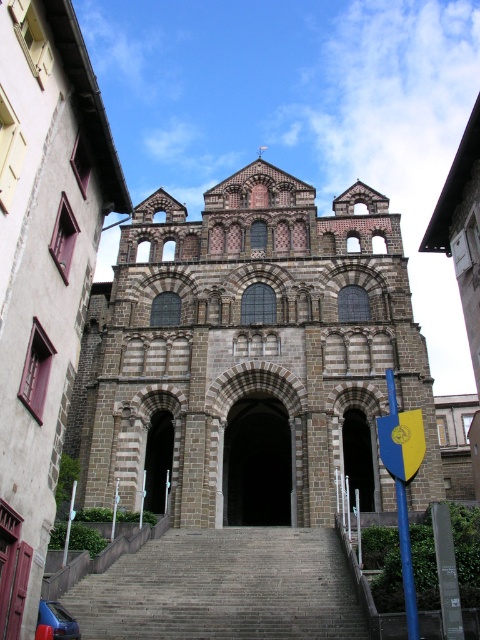
Is point (233, 412) positioned before point (159, 477)?

Yes, it is.

Does point (237, 520) come farther from viewer compared to point (147, 456)?

Yes, point (237, 520) is behind point (147, 456).

Locate an element on the screen. dark stone archway at center is located at coordinates (256, 464).

Which is more to the right, gray stone stairs at center or brown stone archway at center?

Positioned to the right is gray stone stairs at center.

What do you see at coordinates (223, 588) in the screenshot? I see `gray stone stairs at center` at bounding box center [223, 588].

The width and height of the screenshot is (480, 640). I want to click on gray stone stairs at center, so click(x=223, y=588).

Does gray stone stairs at center have a smaller size compared to brown stone arch at center?

Indeed, gray stone stairs at center has a smaller size compared to brown stone arch at center.

Does point (262, 554) come behind point (365, 490)?

No.

This screenshot has height=640, width=480. Find the location of `gray stone stairs at center`. gray stone stairs at center is located at coordinates (223, 588).

This screenshot has height=640, width=480. Find the location of `gray stone stairs at center`. gray stone stairs at center is located at coordinates (223, 588).